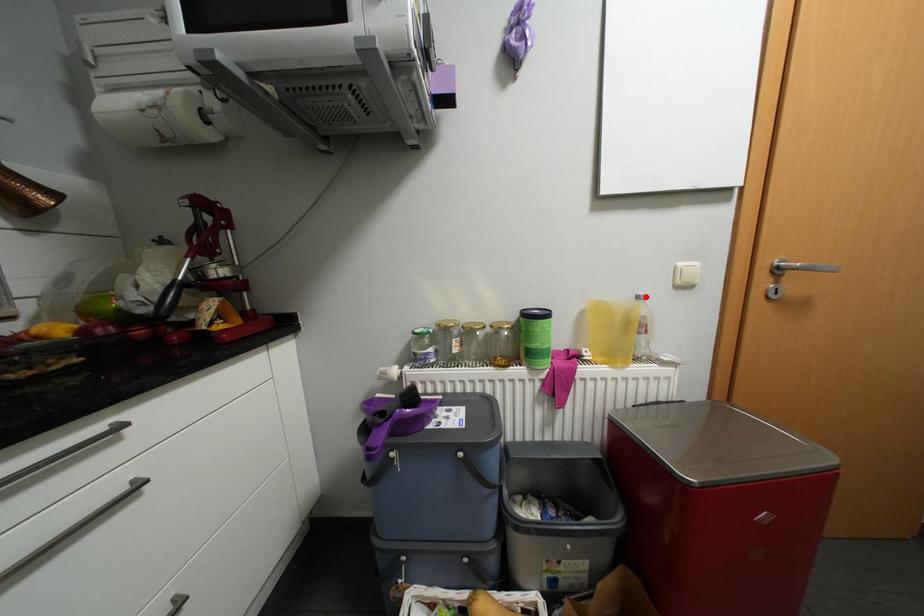
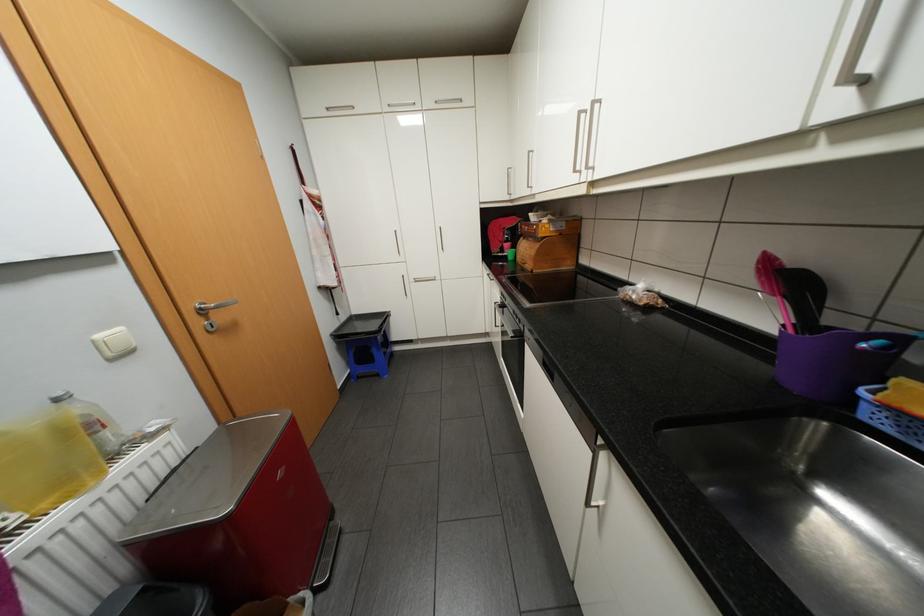
In the second image, find the point that corresponds to the highlighted location in the first image.

(65, 399)